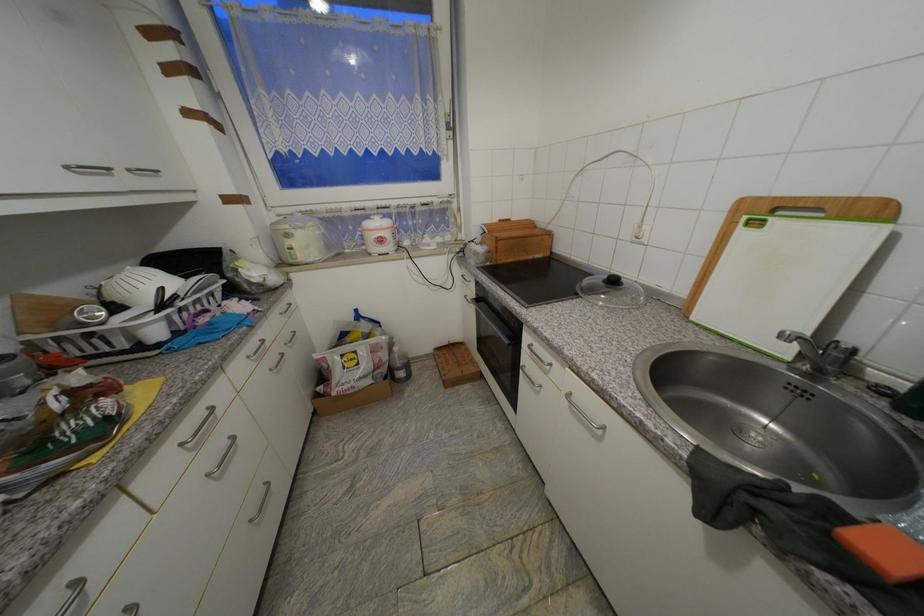
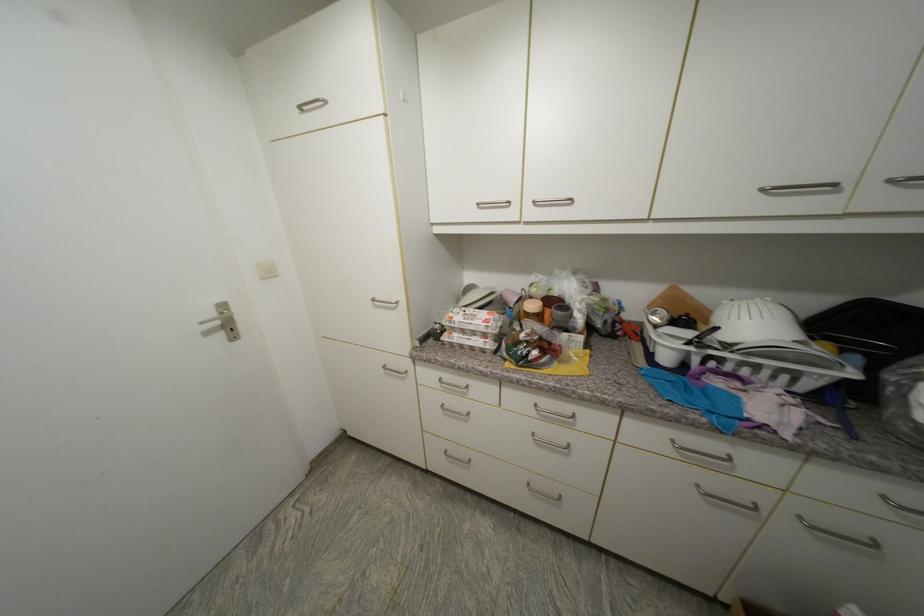
Locate, in the second image, the point that corresponds to point (253, 359) in the first image.

(678, 443)